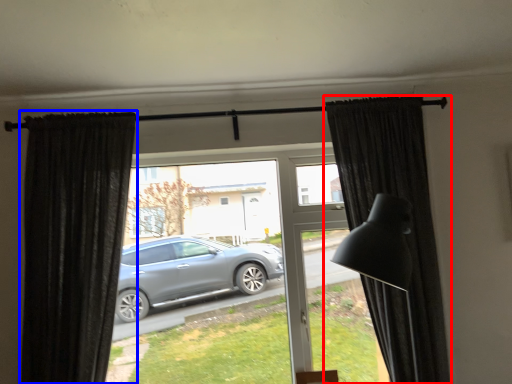
Question: Which object appears closest to the camera in this image, curtain (highlighted by a red box) or curtain (highlighted by a blue box)?

Choices:
 (A) curtain
 (B) curtain

Answer: (A)